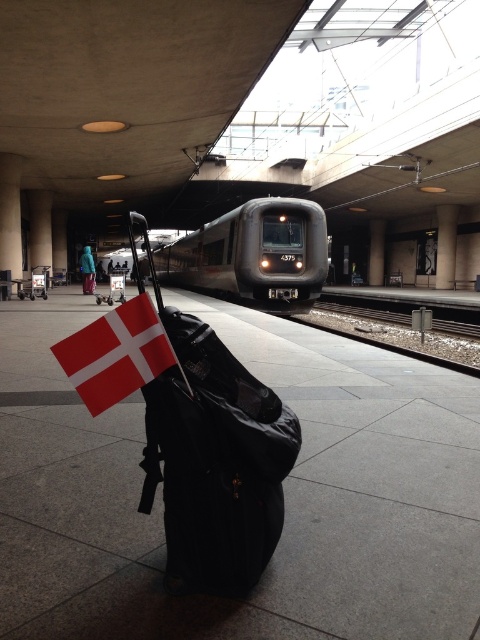
You are standing on the train station platform and see the matte black suitcase at center and the black metal train track at center. Which object is closer to you?

The matte black suitcase at center is closer to you because it is positioned in front of the black metal train track at center.

You are standing on the platform and want to board the metallic gray train at center. Based on your current position, which direction should you walk to reach it?

Since the metallic gray train at center is located at point (x=252, y=253), you should walk towards the center of the platform to reach it.

Based on the photo, you are a traveler at the train station platform. You see the matte black suitcase at center and the red fabric flag at center. Which object is closer to you?

The matte black suitcase at center is closer to you because the red fabric flag at center is behind it.